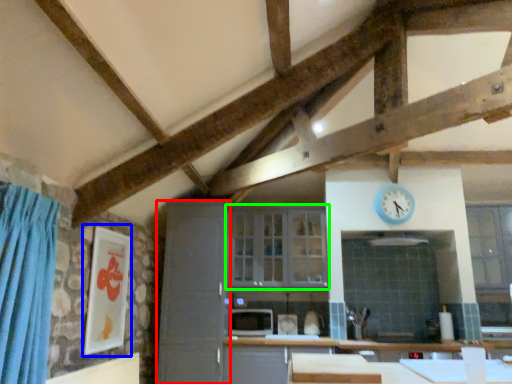
Question: Estimate the real-world distances between objects in this image. Which object is farther from cabinetry (highlighted by a red box), picture frame (highlighted by a blue box) or window (highlighted by a green box)?

Choices:
 (A) picture frame
 (B) window

Answer: (A)